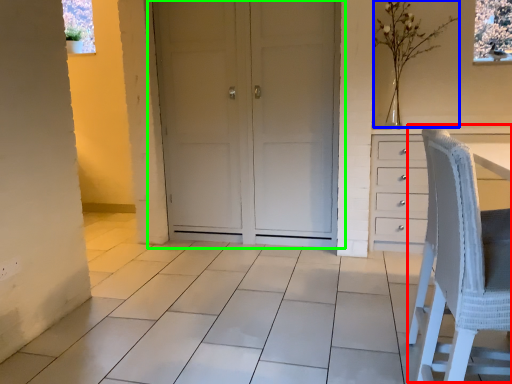
Question: Based on their relative distances, which object is nearer to rocking chair (highlighted by a red box)? Choose from flower (highlighted by a blue box) and door (highlighted by a green box).

Choices:
 (A) flower
 (B) door

Answer: (B)